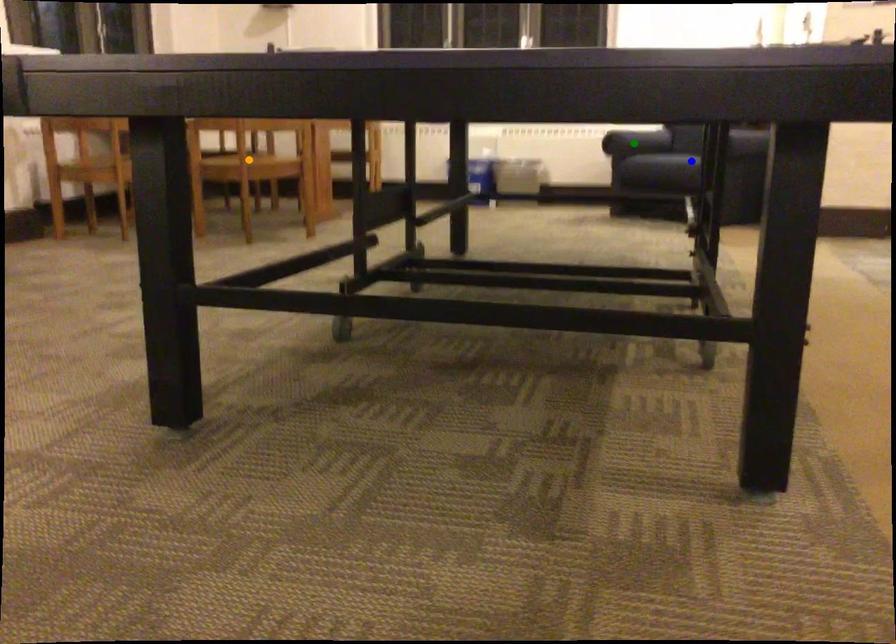
Order these from farthest to nearest:
- orange point
- green point
- blue point

green point, blue point, orange point